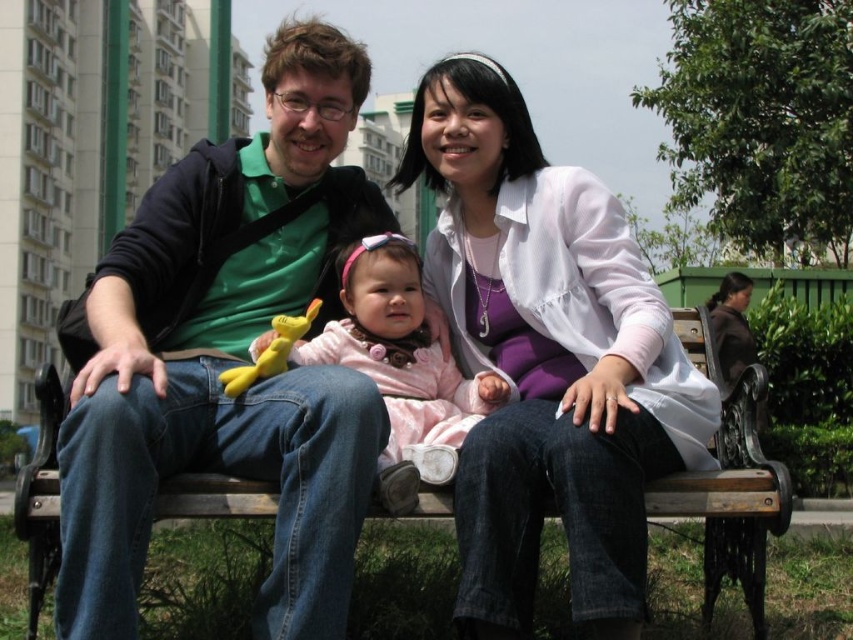
Question: Among these objects, which one is farthest from the camera?

Choices:
 (A) white matte jacket at center
 (B) pink fabric baby at center
 (C) green matte shirt at left

Answer: (B)

Question: Is wooden bench at center positioned behind pink fabric baby at center?

Choices:
 (A) no
 (B) yes

Answer: (A)

Question: Is wooden bench at center positioned at the back of pink fabric baby at center?

Choices:
 (A) no
 (B) yes

Answer: (A)

Question: Which of the following is the farthest from the observer?

Choices:
 (A) white matte jacket at center
 (B) pink fabric baby at center
 (C) green matte shirt at left
 (D) wooden bench at center

Answer: (B)

Question: Can you confirm if wooden bench at center is bigger than pink fabric baby at center?

Choices:
 (A) no
 (B) yes

Answer: (B)

Question: Which point appears closest to the camera in this image?

Choices:
 (A) (54, 612)
 (B) (515, 218)
 (C) (759, 449)
 (D) (258, 342)

Answer: (A)